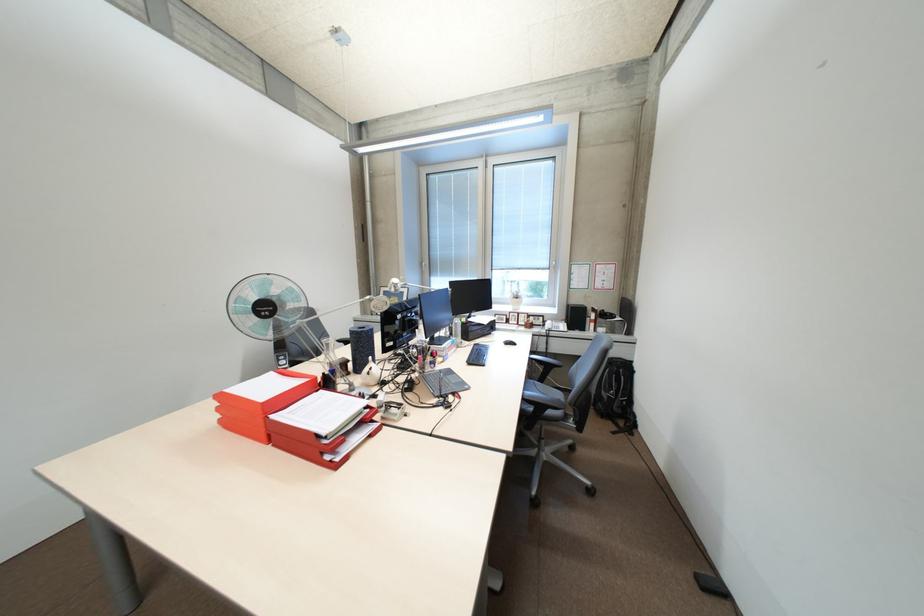
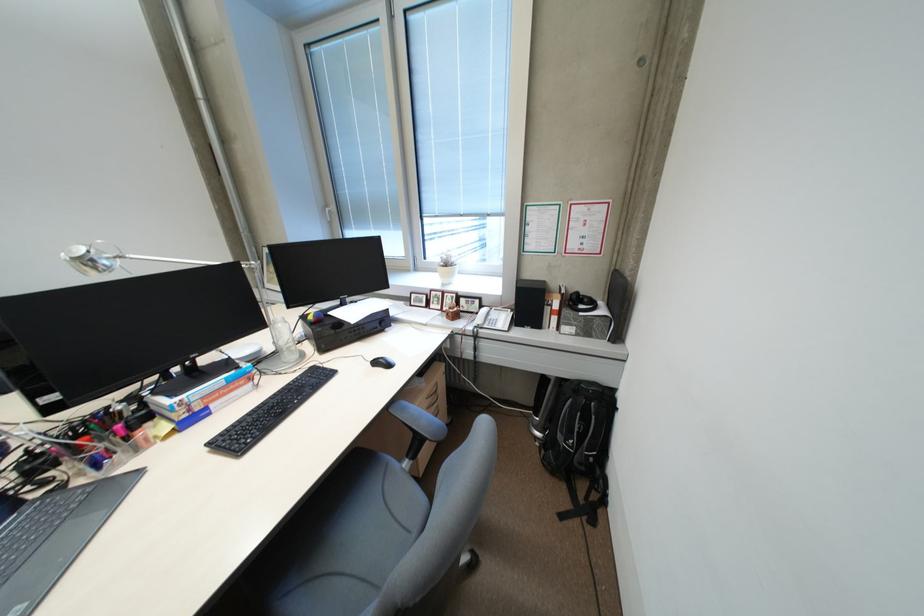
Where in the second image is the point corresponding to (529,313) from the first image?

(454, 292)